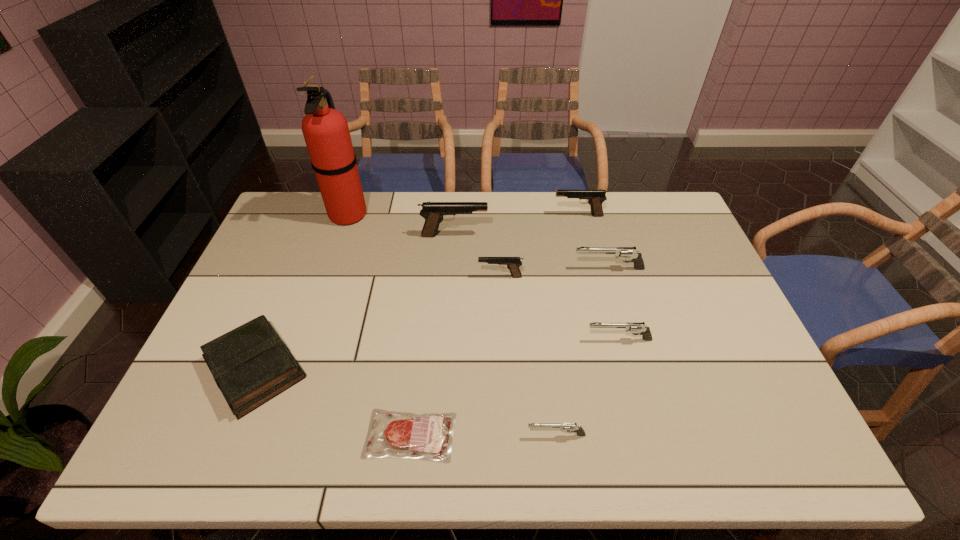
Locate an element on the screen. This screenshot has width=960, height=540. vacant region between the farthest black pistol and the biggest black pistol is located at coordinates pyautogui.click(x=516, y=225).

The width and height of the screenshot is (960, 540). In order to click on empty location between the second tallest pistol and the biggest silver pistol in this screenshot , I will do `click(593, 242)`.

I want to click on free space between the second nearest silver pistol and the fifth nearest object, so click(x=560, y=308).

The image size is (960, 540). In order to click on free point between the tallest object and the shortest object in this screenshot , I will do `click(379, 325)`.

The height and width of the screenshot is (540, 960). Find the location of `free spot between the shortest object and the shortest pistol`. free spot between the shortest object and the shortest pistol is located at coordinates (483, 435).

Where is `object that can be found as the eighth closest to the farthest pistol`? The height and width of the screenshot is (540, 960). object that can be found as the eighth closest to the farthest pistol is located at coordinates (251, 364).

At what (x,y) coordinates should I click in order to perform the action: click on object identified as the closest to the third nearest pistol. Please return your answer as a coordinate pair (x, y). The image size is (960, 540). Looking at the image, I should click on (630, 253).

Locate an element on the screen. Image resolution: width=960 pixels, height=540 pixels. pistol that is the fourth closest to the smallest silver pistol is located at coordinates (434, 213).

Find the location of a particular element. The image size is (960, 540). pistol that is the closest to the farthest pistol is located at coordinates (630, 253).

Identify the location of black pistol that is the third closest to the greenish book. The width and height of the screenshot is (960, 540). (595, 198).